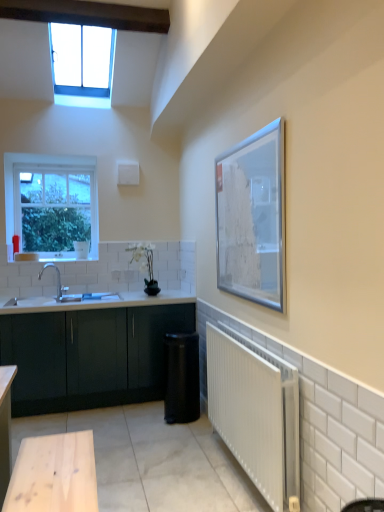
Measure the distance between point (121, 298) and camera.

Point (121, 298) and camera are 3.96 meters apart.

The width and height of the screenshot is (384, 512). Identify the location of clear glass window at upper left, the second window positioned from the back. (82, 59).

What is the approximate width of clear glass window at upper left, the 1th window when ordered from front to back?

clear glass window at upper left, the 1th window when ordered from front to back, is 38.50 inches in width.

Identify the location of silver metallic picture frame at upper right. The image size is (384, 512). (252, 218).

Find the location of a particular element. This screenshot has height=512, width=384. matte dark green cabinet at lower left is located at coordinates (89, 355).

What's the angular difference between clear glass window at upper left, the 1th window in the top-to-bottom sequence, and white glossy sink at lower left's facing directions?

clear glass window at upper left, the 1th window in the top-to-bottom sequence, and white glossy sink at lower left are facing 1.23 degrees away from each other.

Which is in front, point (59, 66) or point (58, 281)?

The point (58, 281) is in front.

From a real-world perspective, between clear glass window at upper left, the 1th window in the top-to-bottom sequence, and white glossy sink at lower left, who is vertically lower?

white glossy sink at lower left, from a real-world perspective.

Is there a large distance between clear glass window at upper left, the 1th window when ordered from front to back, and white glossy sink at lower left?

Yes, clear glass window at upper left, the 1th window when ordered from front to back, is far from white glossy sink at lower left.

Is clear glass window at upper left, the 1th window viewed from the back, positioned with its back to white glossy sink at lower left?

That's not correct — clear glass window at upper left, the 1th window viewed from the back, is not looking away from white glossy sink at lower left.

From the image's perspective, is clear glass window at upper left, the 1th window viewed from the back, under white glossy sink at lower left?

No, from the image's perspective, clear glass window at upper left, the 1th window viewed from the back, is not beneath white glossy sink at lower left.

Can you confirm if clear glass window at upper left, the 1th window viewed from the back, is thinner than white glossy sink at lower left?

Indeed, clear glass window at upper left, the 1th window viewed from the back, has a lesser width compared to white glossy sink at lower left.

Is white metallic radiator at lower right a part of clear glass window at upper left, which is the second window in top-to-bottom order?

No, clear glass window at upper left, which is the second window in top-to-bottom order, does not contain white metallic radiator at lower right.

How far apart are clear glass window at upper left, the 1th window from the bottom, and white metallic radiator at lower right?

clear glass window at upper left, the 1th window from the bottom, is 2.48 meters away from white metallic radiator at lower right.

How different are the orientations of clear glass window at upper left, the 1th window viewed from the back, and white metallic radiator at lower right in degrees?

89.2 degrees.

From the image's perspective, is clear glass window at upper left, which is the second window in top-to-bottom order, located beneath white metallic radiator at lower right?

Incorrect, from the image's perspective, clear glass window at upper left, which is the second window in top-to-bottom order, is higher than white metallic radiator at lower right.

Looking at their sizes, would you say silver metallic picture frame at upper right is wider or thinner than white metallic radiator at lower right?

silver metallic picture frame at upper right is thinner than white metallic radiator at lower right.

Which is nearer, (x=262, y=220) or (x=224, y=348)?

Point (x=262, y=220) is closer to the camera than point (x=224, y=348).

Choose the correct answer: Is silver metallic picture frame at upper right inside white metallic radiator at lower right or outside it?

silver metallic picture frame at upper right is outside white metallic radiator at lower right.

Is point (275, 469) closer or farther from the camera than point (53, 236)?

Point (275, 469) appears to be closer to the viewer than point (53, 236).

From a real-world perspective, relative to clear glass window at upper left, which is counted as the second window, starting from the front, is white metallic radiator at lower right vertically above or below?

From a real-world perspective, white metallic radiator at lower right is physically below clear glass window at upper left, which is counted as the second window, starting from the front.

Looking at this image, between white metallic radiator at lower right and clear glass window at upper left, which is counted as the second window, starting from the front, which one has less height?

white metallic radiator at lower right is shorter.

Is white metallic radiator at lower right inside white glossy sink at lower left?

No, white glossy sink at lower left does not contain white metallic radiator at lower right.

From the image's perspective, which is below, white glossy sink at lower left or white metallic radiator at lower right?

white metallic radiator at lower right, from the image's perspective.

Is white glossy sink at lower left further to the viewer compared to white metallic radiator at lower right?

Yes, white glossy sink at lower left is further from the camera.

Is clear glass window at upper left, marked as the 2th window in a bottom-to-top arrangement, facing away from clear glass window at upper left, which is counted as the second window, starting from the front?

clear glass window at upper left, marked as the 2th window in a bottom-to-top arrangement, is not turned away from clear glass window at upper left, which is counted as the second window, starting from the front.

Does point (88, 76) appear closer or farther from the camera than point (89, 229)?

Point (88, 76) appears to be farther away from the viewer than point (89, 229).

In the image, is clear glass window at upper left, the second window positioned from the back, positioned in front of or behind clear glass window at upper left, the 1th window from the bottom?

Clearly, clear glass window at upper left, the second window positioned from the back, is in front of clear glass window at upper left, the 1th window from the bottom.

I want to click on window in front of the white glossy sink at lower left, so click(x=82, y=59).

The image size is (384, 512). Find the location of `window behind the white glossy sink at lower left`. window behind the white glossy sink at lower left is located at coordinates (52, 204).

Looking at the image, which one is located further to clear glass window at upper left, marked as the 2th window in a bottom-to-top arrangement, white metallic radiator at lower right or silver metallic picture frame at upper right?

The object further to clear glass window at upper left, marked as the 2th window in a bottom-to-top arrangement, is white metallic radiator at lower right.

Considering their positions, is matte dark green cabinet at lower left positioned further to clear glass window at upper left, the 1th window when ordered from front to back, than white glossy sink at lower left?

Among the two, matte dark green cabinet at lower left is located further to clear glass window at upper left, the 1th window when ordered from front to back.

Based on their spatial positions, is white glossy sink at lower left or silver metallic picture frame at upper right further from clear glass window at upper left, the 1th window when ordered from front to back?

silver metallic picture frame at upper right lies further to clear glass window at upper left, the 1th window when ordered from front to back, than the other object.

Estimate the real-world distances between objects in this image. Which object is further from clear glass window at upper left, which is the second window in top-to-bottom order, clear glass window at upper left, the 1th window in the top-to-bottom sequence, or white metallic radiator at lower right?

clear glass window at upper left, the 1th window in the top-to-bottom sequence, is positioned further to the anchor clear glass window at upper left, which is the second window in top-to-bottom order.

Looking at the image, which one is located further to silver metallic picture frame at upper right, white glossy sink at lower left or clear glass window at upper left, which is the second window in top-to-bottom order?

clear glass window at upper left, which is the second window in top-to-bottom order.

Which object lies further to the anchor point matte dark green cabinet at lower left, black matte water heater at lower right or white metallic radiator at lower right?

white metallic radiator at lower right.

When comparing their distances from matte dark green cabinet at lower left, does clear glass window at upper left, the 1th window when ordered from front to back, or white glossy sink at lower left seem further?

clear glass window at upper left, the 1th window when ordered from front to back.

From the image, which object appears to be nearer to clear glass window at upper left, which is the second window in top-to-bottom order, matte dark green cabinet at lower left or clear glass window at upper left, the 1th window in the top-to-bottom sequence?

matte dark green cabinet at lower left is positioned closer to the anchor clear glass window at upper left, which is the second window in top-to-bottom order.

Locate an element on the screen. This screenshot has width=384, height=512. cabinetry located between white metallic radiator at lower right and clear glass window at upper left, the 1th window viewed from the back, in the depth direction is located at coordinates (89, 355).

Locate an element on the screen. The height and width of the screenshot is (512, 384). water heater between silver metallic picture frame at upper right and matte dark green cabinet at lower left in the front-back direction is located at coordinates (181, 378).

This screenshot has height=512, width=384. In order to click on picture frame between white metallic radiator at lower right and clear glass window at upper left, which is the second window in top-to-bottom order, along the z-axis in this screenshot , I will do `click(252, 218)`.

In order to click on picture frame between clear glass window at upper left, the 1th window in the top-to-bottom sequence, and matte dark green cabinet at lower left, in the vertical direction in this screenshot , I will do `click(252, 218)`.